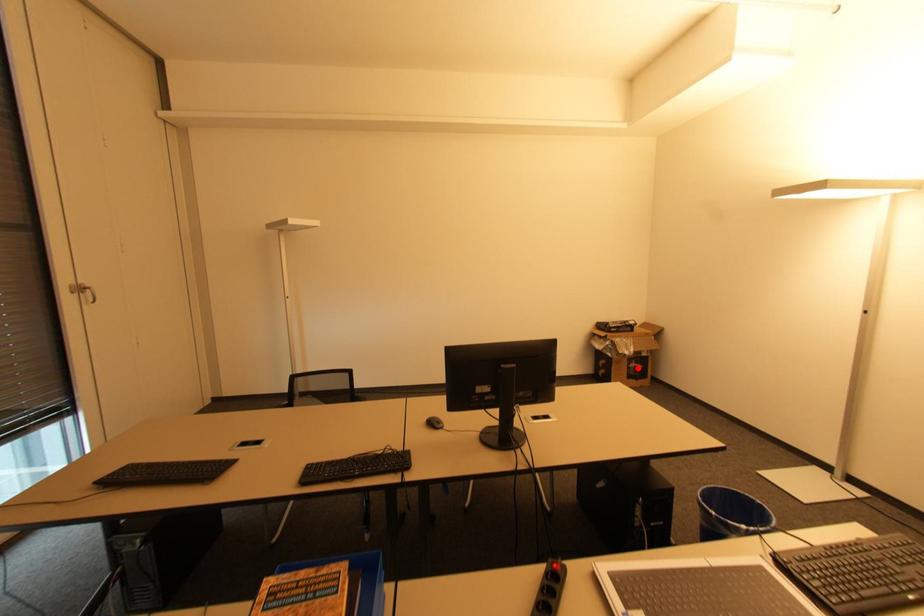
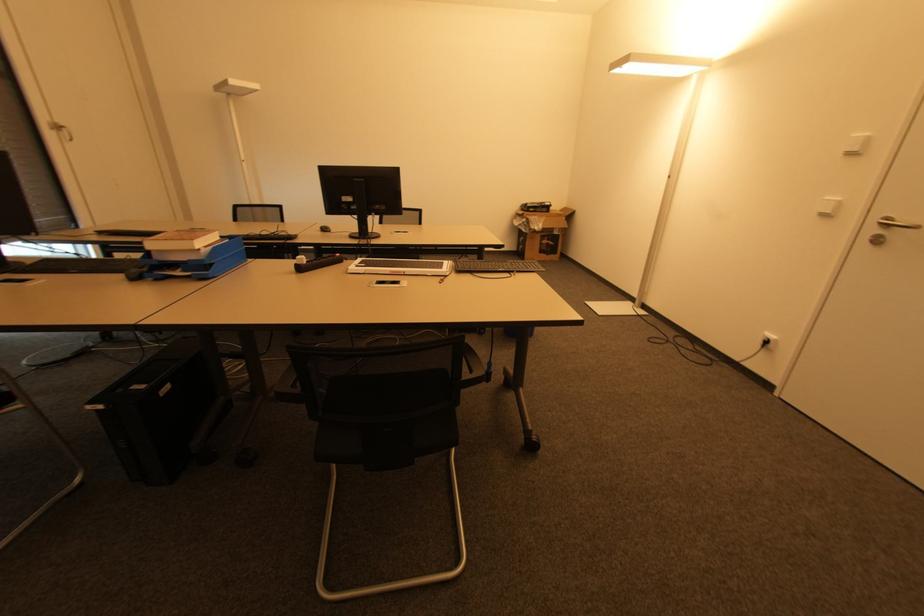
Find the pixel in the second image that matches the highlighted location in the first image.

(550, 245)